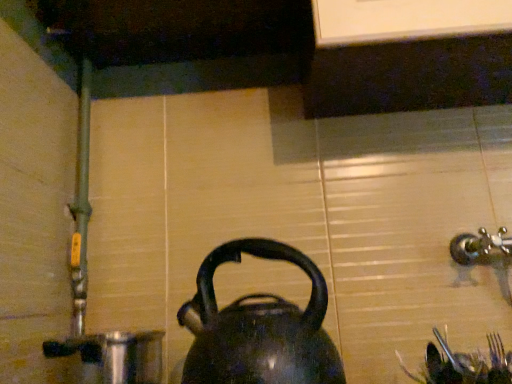
Question: Is shiny metallic pot at lower left situated inside shiny black kettle at center or outside?

Choices:
 (A) inside
 (B) outside

Answer: (B)

Question: Looking at the image, does shiny metallic pot at lower left seem bigger or smaller compared to shiny black kettle at center?

Choices:
 (A) small
 (B) big

Answer: (B)

Question: Is point (100, 355) positioned closer to the camera than point (199, 342)?

Choices:
 (A) closer
 (B) farther

Answer: (B)

Question: Which is correct: shiny black kettle at center is inside shiny metallic pot at lower left, or outside of it?

Choices:
 (A) inside
 (B) outside

Answer: (B)

Question: Considering the positions of point coord(196,344) and point coord(79,337), is point coord(196,344) closer or farther from the camera than point coord(79,337)?

Choices:
 (A) farther
 (B) closer

Answer: (B)

Question: From the image's perspective, is shiny black kettle at center above or below shiny metallic pot at lower left?

Choices:
 (A) below
 (B) above

Answer: (B)

Question: In the image, is shiny black kettle at center positioned in front of or behind shiny metallic pot at lower left?

Choices:
 (A) front
 (B) behind

Answer: (A)